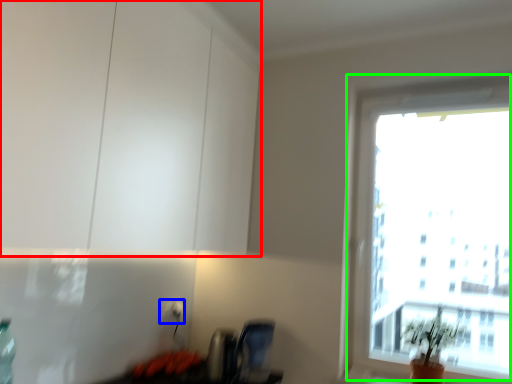
Question: Which object is positioned farthest from cabinetry (highlighted by a red box)? Select from electric outlet (highlighted by a blue box) and window (highlighted by a green box).

Choices:
 (A) electric outlet
 (B) window

Answer: (B)